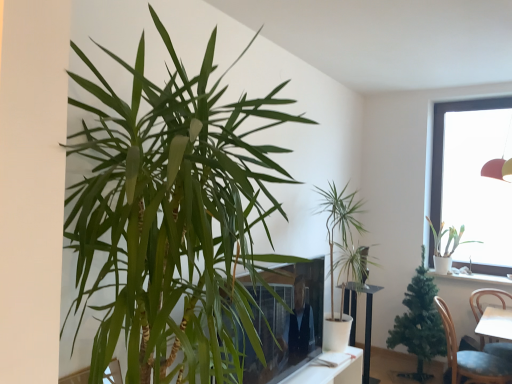
Question: Could you tell me if transparent glass window at upper right is facing white ceramic pot at upper right?

Choices:
 (A) no
 (B) yes

Answer: (B)

Question: From the image's perspective, is transparent glass window at upper right beneath white ceramic pot at upper right?

Choices:
 (A) yes
 (B) no

Answer: (B)

Question: Is transparent glass window at upper right not near white ceramic pot at upper right?

Choices:
 (A) yes
 (B) no

Answer: (B)

Question: Is the depth of transparent glass window at upper right greater than that of white ceramic pot at upper right?

Choices:
 (A) no
 (B) yes

Answer: (B)

Question: Is transparent glass window at upper right outside of white ceramic pot at upper right?

Choices:
 (A) yes
 (B) no

Answer: (A)

Question: From a real-world perspective, is transparent glass window at upper right positioned over white ceramic pot at upper right based on gravity?

Choices:
 (A) no
 (B) yes

Answer: (B)

Question: From the image's perspective, is white ceramic pot at upper right on top of transparent glass window at upper right?

Choices:
 (A) yes
 (B) no

Answer: (B)

Question: Does white ceramic pot at upper right contain transparent glass window at upper right?

Choices:
 (A) no
 (B) yes

Answer: (A)

Question: Would you consider white ceramic pot at upper right to be distant from transparent glass window at upper right?

Choices:
 (A) no
 (B) yes

Answer: (A)

Question: Is transparent glass window at upper right at the back of white ceramic pot at upper right?

Choices:
 (A) yes
 (B) no

Answer: (B)

Question: Is white ceramic pot at upper right positioned in front of transparent glass window at upper right?

Choices:
 (A) no
 (B) yes

Answer: (B)

Question: Does white ceramic pot at upper right appear on the right side of transparent glass window at upper right?

Choices:
 (A) no
 (B) yes

Answer: (A)

Question: Can you confirm if green leafy plant at center, positioned as the second houseplant in front-to-back order, is smaller than blue fabric chair at lower right?

Choices:
 (A) no
 (B) yes

Answer: (A)